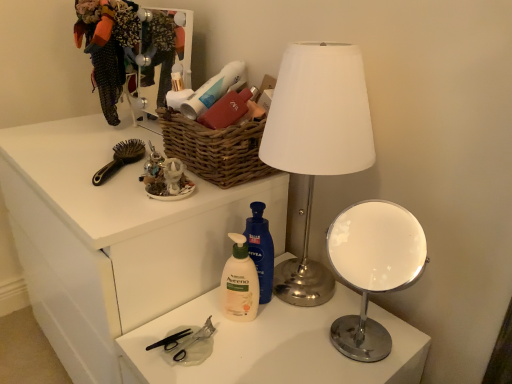
At what (x,y) coordinates should I click in order to perform the action: click on free space between chrome/metallic table lamp at right and white plastic pump bottle at center, the 2th cleaning product viewed from the left. Please return your answer as a coordinate pair (x, y). Looking at the image, I should click on (307, 323).